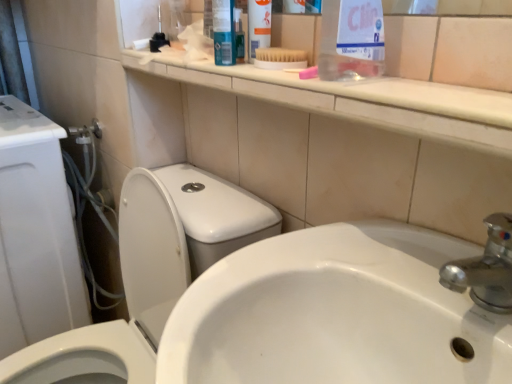
In order to click on white plastic brush at upper center in this screenshot , I will do `click(258, 26)`.

What do you see at coordinates (125, 292) in the screenshot?
I see `white glossy toilet at left` at bounding box center [125, 292].

What is the approximate width of clear plastic bottle at upper center?

The width of clear plastic bottle at upper center is 3.84 inches.

Identify the location of white glossy toilet at left. Image resolution: width=512 pixels, height=384 pixels. tap(35, 233).

Are white glossy sink at lower left and clear plastic bottle at upper center beside each other?

No.

Is clear plastic bottle at upper center located within white glossy sink at lower left?

No, clear plastic bottle at upper center is located outside of white glossy sink at lower left.

Is white glossy sink at lower left oriented away from clear plastic bottle at upper center?

No, white glossy sink at lower left's orientation is not away from clear plastic bottle at upper center.

In terms of width, does white glossy sink at lower left look wider or thinner when compared to clear plastic bottle at upper center?

Clearly, white glossy sink at lower left has more width compared to clear plastic bottle at upper center.

In the image, is white plastic brush at upper center positioned in front of or behind clear plastic bottle at upper center?

white plastic brush at upper center is behind clear plastic bottle at upper center.

Which of these two, white plastic brush at upper center or clear plastic bottle at upper center, is bigger?

→ clear plastic bottle at upper center is bigger.

At what (x,y) coordinates should I click in order to perform the action: click on toiletry behind the clear plastic bottle at upper center. Please return your answer as a coordinate pair (x, y). Looking at the image, I should click on (258, 26).

Between white plastic brush at upper center and clear plastic bottle at upper center, which one appears on the left side from the viewer's perspective?

From the viewer's perspective, white plastic brush at upper center appears more on the left side.

Is clear plastic bottle at upper center turned away from white glossy sink at lower left?

No, clear plastic bottle at upper center is not facing away from white glossy sink at lower left.

Who is more distant, clear plastic bottle at upper center or white glossy sink at lower left?

clear plastic bottle at upper center is further from the camera.

From a real-world perspective, which object rests below the other?

white glossy sink at lower left.

Considering the sizes of objects clear plastic bottle at upper center and white glossy sink at lower left in the image provided, who is bigger, clear plastic bottle at upper center or white glossy sink at lower left?

white glossy sink at lower left.

Where is `toiletry behind the white glossy sink at lower left`? The image size is (512, 384). toiletry behind the white glossy sink at lower left is located at coordinates (258, 26).

From the image's perspective, is white plastic brush at upper center located beneath white glossy sink at lower left?

Incorrect, from the image's perspective, white plastic brush at upper center is higher than white glossy sink at lower left.

Is white plastic brush at upper center oriented towards white glossy sink at lower left?

No, white plastic brush at upper center is not oriented towards white glossy sink at lower left.

Can we say white plastic brush at upper center lies outside white glossy sink at lower left?

→ Yes, white plastic brush at upper center is outside of white glossy sink at lower left.

In terms of width, does white glossy toilet at left look wider or thinner when compared to white plastic brush at upper center?

Clearly, white glossy toilet at left has more width compared to white plastic brush at upper center.

Would you say white glossy toilet at left contains white plastic brush at upper center?

Actually, white plastic brush at upper center is outside white glossy toilet at left.

Which is behind, point (160, 252) or point (265, 8)?

The point (160, 252) is behind.

Is white glossy toilet at left facing towards white plastic brush at upper center?

No, white glossy toilet at left is not oriented towards white plastic brush at upper center.

Find the location of a particular element. sink that appears on the right of white plastic brush at upper center is located at coordinates (349, 309).

From the image's perspective, between white glossy sink at lower left and white plastic brush at upper center, which one is located above?

white plastic brush at upper center is shown above in the image.

Is white glossy sink at lower left looking in the opposite direction of white plastic brush at upper center?

white glossy sink at lower left does not have its back to white plastic brush at upper center.

Based on their sizes in the image, would you say white glossy sink at lower left is bigger or smaller than white plastic brush at upper center?

Clearly, white glossy sink at lower left is larger in size than white plastic brush at upper center.

Which is in front, point (92, 334) or point (6, 97)?

The point (92, 334) is more forward.

Considering the relative sizes of white glossy toilet at left and white glossy toilet at left in the image provided, is white glossy toilet at left smaller than white glossy toilet at left?

Correct, white glossy toilet at left occupies less space than white glossy toilet at left.

From the image's perspective, which one is positioned higher, white glossy toilet at left or white glossy toilet at left?

From the image's view, white glossy toilet at left is above.

Identify the location of sink below the clear plastic bottle at upper center (from the image's perspective). Image resolution: width=512 pixels, height=384 pixels. (349, 309).

Where is `toiletry behind the clear plastic bottle at upper center`? The width and height of the screenshot is (512, 384). toiletry behind the clear plastic bottle at upper center is located at coordinates (258, 26).

Based on their spatial positions, is white plastic brush at upper center or white glossy sink at lower left closer to clear plastic bottle at upper center?

white plastic brush at upper center lies closer to clear plastic bottle at upper center than the other object.

Looking at the image, which one is located further to white glossy toilet at left, white glossy toilet at left or white glossy sink at lower left?

white glossy sink at lower left is positioned further to the anchor white glossy toilet at left.

Which object lies nearer to the anchor point clear plastic bottle at upper center, white glossy toilet at left or white glossy toilet at left?

white glossy toilet at left is closer to clear plastic bottle at upper center.

Considering their positions, is white glossy sink at lower left positioned closer to white glossy toilet at left than clear plastic bottle at upper center?

The object closer to white glossy toilet at left is white glossy sink at lower left.

Estimate the real-world distances between objects in this image. Which object is further from white glossy toilet at left, white plastic brush at upper center or clear plastic bottle at upper center?

Based on the image, clear plastic bottle at upper center appears to be further to white glossy toilet at left.

Which object lies nearer to the anchor point white glossy toilet at left, white glossy sink at lower left or white glossy toilet at left?

white glossy toilet at left is closer to white glossy toilet at left.

Looking at the image, which one is located further to clear plastic bottle at upper center, white glossy sink at lower left or white glossy toilet at left?

white glossy toilet at left lies further to clear plastic bottle at upper center than the other object.

Looking at the image, which one is located closer to white plastic brush at upper center, white glossy sink at lower left or white glossy toilet at left?

white glossy sink at lower left lies closer to white plastic brush at upper center than the other object.

You are a GUI agent. You are given a task and a screenshot of the screen. Output one action in this format:
    pyautogui.click(x=<x>, y=<y>)
    Task: Click on the toiletry between white glossy toilet at left and white glossy sink at lower left
    Image resolution: width=512 pixels, height=384 pixels.
    Given the screenshot: What is the action you would take?
    pyautogui.click(x=258, y=26)

Image resolution: width=512 pixels, height=384 pixels. What are the coordinates of `sink between white plastic brush at upper center and white glossy toilet at left vertically` in the screenshot? It's located at (349, 309).

Locate an element on the screen. Image resolution: width=512 pixels, height=384 pixels. cleaning product between white plastic brush at upper center and white glossy toilet at left from top to bottom is located at coordinates (351, 40).

Image resolution: width=512 pixels, height=384 pixels. What are the coordinates of `toiletry located between white glossy toilet at left and clear plastic bottle at upper center in the left-right direction` in the screenshot? It's located at (258, 26).